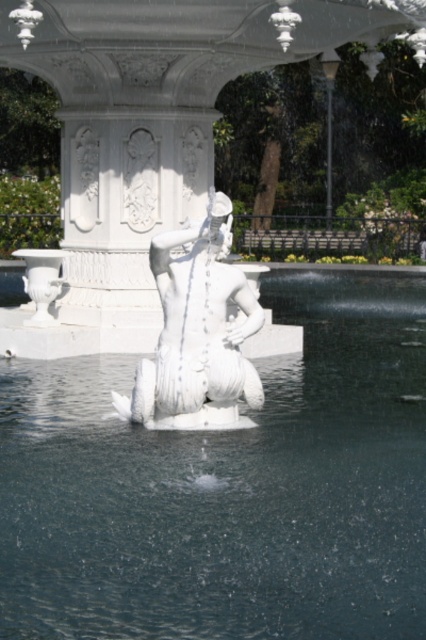
Does clear water at statue center appear over white marble statue at center?

Actually, clear water at statue center is below white marble statue at center.

Can you confirm if clear water at statue center is smaller than white marble statue at center?

No, clear water at statue center is not smaller than white marble statue at center.

This screenshot has height=640, width=426. What do you see at coordinates (229, 486) in the screenshot?
I see `clear water at statue center` at bounding box center [229, 486].

The image size is (426, 640). What are the coordinates of `clear water at statue center` in the screenshot? It's located at (229, 486).